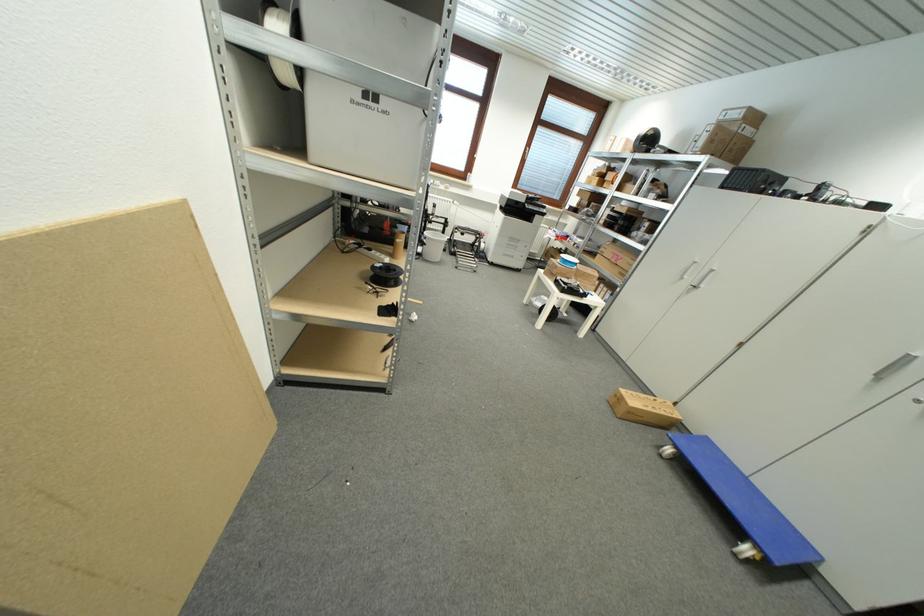
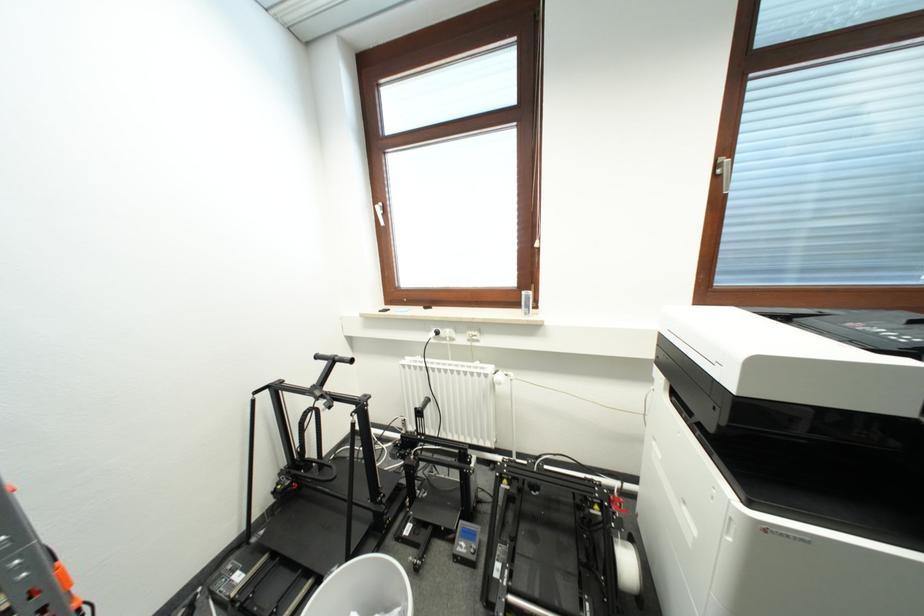
Question: I am providing you with two images of the same scene from different viewpoints. After the viewpoint changes to image2, which objects are now occluded?

Choices:
 (A) printer scanner lid
 (B) black T-shaped handle
 (C) white trash can
 (D) none of these

Answer: (D)